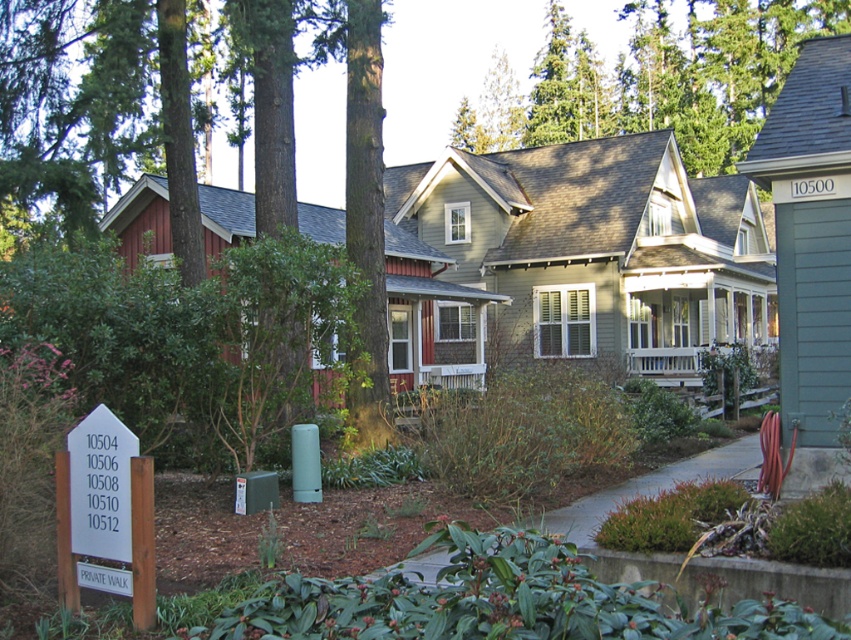
You are standing in front of the house and want to walk from the green rough bark tree at left to the white wooden porch at center. Which direction should you move?

Since the green rough bark tree at left is to the left of the white wooden porch at center, you should move to the right to reach the porch from the tree.

You are a delivery person standing at the white plastic sign at lower left and need to deliver a package to the green textured tree at upper center. The delivery vehicle can only travel up to 50 meters. Can you reach the destination without exceeding the vehicle range?

The distance between the green textured tree at upper center and the white plastic sign at lower left is 46.50 meters, which is within the vehicle range of 50 meters. Therefore, you can reach the destination without exceeding the vehicle range.

You are a delivery person trying to locate the correct house. You see the green textured tree at upper center and the white plastic sign at lower left. Which object is bigger and can help you identify the location more easily?

The green textured tree at upper center is larger in size than the white plastic sign at lower left, so it can be more easily identified as a landmark to help locate the correct house.